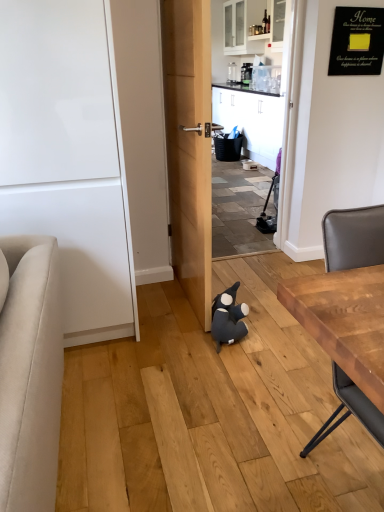
Identify the location of white glossy door at left. (65, 157).

I want to click on dark blue plush toy at center, so click(x=228, y=317).

What is the approximate height of wooden table at right?

wooden table at right is 35.83 inches tall.

The width and height of the screenshot is (384, 512). I want to click on white glossy door at left, so (x=65, y=157).

Identify the location of animal directly beneath the white glossy door at left (from a real-world perspective). (228, 317).

Who is smaller, white glossy door at left or dark blue plush toy at center?

With smaller size is dark blue plush toy at center.

Are white glossy door at left and dark blue plush toy at center located far from each other?

No, there isn't a large distance between white glossy door at left and dark blue plush toy at center.

Is white glossy door at left oriented away from dark blue plush toy at center?

No, white glossy door at left's orientation is not away from dark blue plush toy at center.

From a real-world perspective, is white glossy door at left positioned above or below wooden table at right?

white glossy door at left is situated higher than wooden table at right in the real world.

How many degrees apart are the facing directions of white glossy door at left and wooden table at right?

The angular difference between white glossy door at left and wooden table at right is 3.15 degrees.

Is point (28, 211) closer to camera compared to point (336, 358)?

No, it is behind (336, 358).

Considering the sizes of objects white glossy door at left and wooden table at right in the image provided, who is shorter, white glossy door at left or wooden table at right?

wooden table at right is shorter.

From the image's perspective, which one is positioned higher, dark blue plush toy at center or wooden table at right?

dark blue plush toy at center is shown above in the image.

Is dark blue plush toy at center placed right next to wooden table at right?

No, dark blue plush toy at center is not touching wooden table at right.

Is dark blue plush toy at center turned away from wooden table at right?

No, dark blue plush toy at center's orientation is not away from wooden table at right.

Considering the relative sizes of dark blue plush toy at center and wooden table at right in the image provided, is dark blue plush toy at center thinner than wooden table at right?

Correct, the width of dark blue plush toy at center is less than that of wooden table at right.

Can we say wooden table at right lies outside dark blue plush toy at center?

Yes.

Is wooden table at right taller than dark blue plush toy at center?

Yes.

Based on the photo, is the position of wooden table at right less distant than that of dark blue plush toy at center?

Yes, it is in front of dark blue plush toy at center.

From a real-world perspective, between wooden table at right and dark blue plush toy at center, who is vertically higher?

wooden table at right is physically above.

Considering the sizes of wooden table at right and white glossy door at left in the image, is wooden table at right taller or shorter than white glossy door at left?

Clearly, wooden table at right is shorter compared to white glossy door at left.

Is wooden table at right aimed at white glossy door at left?

No, wooden table at right is not aimed at white glossy door at left.

Which object is positioned more to the left, wooden table at right or white glossy door at left?

white glossy door at left is more to the left.

Does wooden table at right have a lesser width compared to white glossy door at left?

Yes.

Which of these two, dark blue plush toy at center or white glossy door at left, stands shorter?

dark blue plush toy at center.

Can you see dark blue plush toy at center touching white glossy door at left?

No, dark blue plush toy at center is not beside white glossy door at left.

Is white glossy door at left located within dark blue plush toy at center?

No, white glossy door at left is located outside of dark blue plush toy at center.

Can you tell me how much dark blue plush toy at center and white glossy door at left differ in facing direction?

dark blue plush toy at center and white glossy door at left are facing 86.8 degrees away from each other.

Where is `door on the left of dark blue plush toy at center`? door on the left of dark blue plush toy at center is located at coordinates (65, 157).

Find the location of a particular element. The width and height of the screenshot is (384, 512). door behind the wooden table at right is located at coordinates (65, 157).

Which object lies nearer to the anchor point dark blue plush toy at center, wooden table at right or white glossy door at left?

The object closer to dark blue plush toy at center is white glossy door at left.

Considering their positions, is white glossy door at left positioned further to dark blue plush toy at center than wooden table at right?

wooden table at right.

Considering their positions, is white glossy door at left positioned closer to wooden table at right than dark blue plush toy at center?

Among the two, dark blue plush toy at center is located nearer to wooden table at right.

Which object lies further to the anchor point white glossy door at left, dark blue plush toy at center or wooden table at right?

Based on the image, wooden table at right appears to be further to white glossy door at left.

Which object lies further to the anchor point wooden table at right, dark blue plush toy at center or white glossy door at left?

white glossy door at left lies further to wooden table at right than the other object.

Considering their positions, is wooden table at right positioned further to white glossy door at left than dark blue plush toy at center?

wooden table at right lies further to white glossy door at left than the other object.

Locate an element on the screen. This screenshot has height=512, width=384. animal between white glossy door at left and wooden table at right in the horizontal direction is located at coordinates (228, 317).